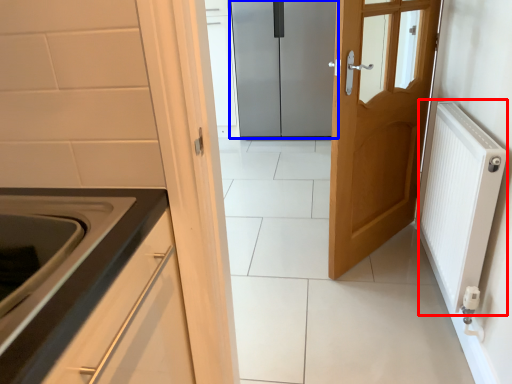
Question: Which point is closer to the camera, radiator (highlighted by a red box) or door (highlighted by a blue box)?

Choices:
 (A) radiator
 (B) door

Answer: (A)